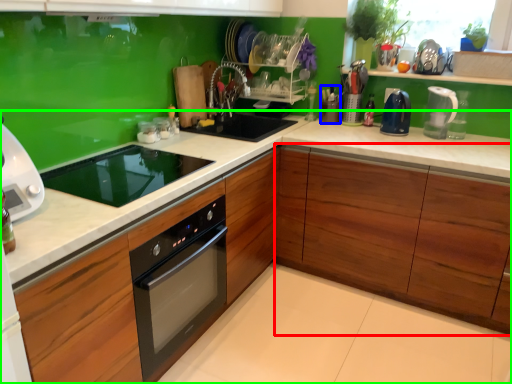
Question: Which object is the closest to the cabinetry (highlighted by a red box)? Choose among these: appliance (highlighted by a blue box) or countertop (highlighted by a green box).

Choices:
 (A) appliance
 (B) countertop

Answer: (B)